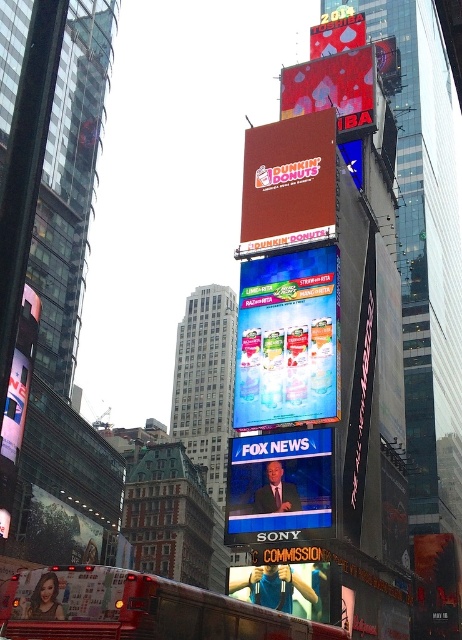
You are a photographer standing in Times Square, New York City. You notice a matte blue screen at center and a matte black bus at left. Which object is positioned lower in the image?

The matte blue screen at center is positioned lower than the matte black bus at left.

You are a window cleaner standing on the ground looking up at the shiny red billboard at upper center and the blue fabric at lower center. Which object is higher up in the scene?

The shiny red billboard at upper center is higher up in the scene than the blue fabric at lower center.

You are a photographer trying to capture the shiny red billboard at upper center and the matte black bus at left in a single shot. Based on their sizes in the image, which object appears smaller?

The shiny red billboard at upper center appears smaller because it is shorter than the matte black bus at left.